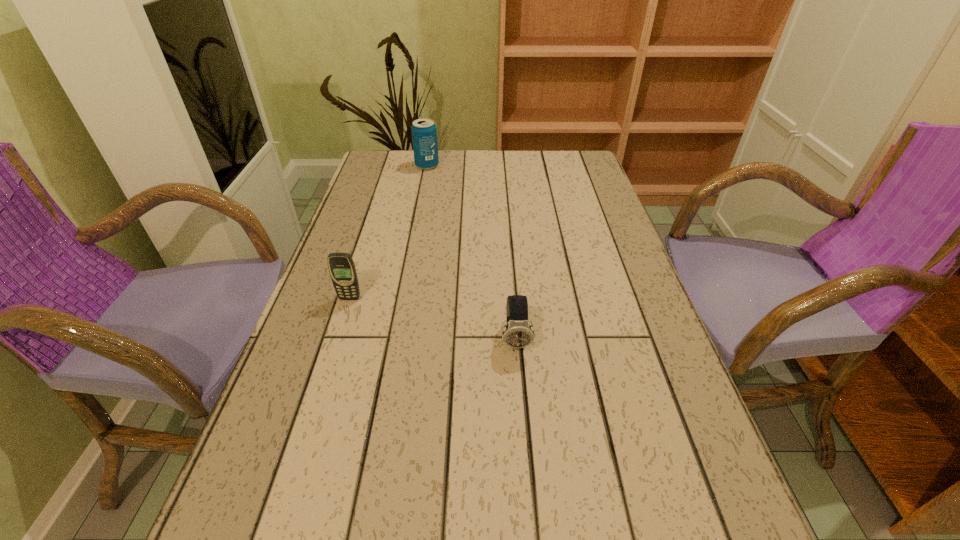
I want to click on the tallest object, so click(424, 132).

You are a GUI agent. You are given a task and a screenshot of the screen. Output one action in this format:
    pyautogui.click(x=<x>, y=<y>)
    Task: Click on the farthest object
    The image size is (960, 540).
    Given the screenshot: What is the action you would take?
    pyautogui.click(x=424, y=132)

Identify the location of cellular telephone. (341, 266).

Where is `the leftmost object`? The width and height of the screenshot is (960, 540). the leftmost object is located at coordinates (341, 266).

Find the location of a particular element. The height and width of the screenshot is (540, 960). the nearest object is located at coordinates (517, 334).

Identify the location of watch. 517,334.

The height and width of the screenshot is (540, 960). What are the coordinates of `free spot located on the right of the farthest object` in the screenshot? It's located at (551, 166).

I want to click on vacant space located on the screen of the cellular telephone, so [x=333, y=350].

Locate an element on the screen. The width and height of the screenshot is (960, 540). free space located 0.320m on the face of the watch is located at coordinates [532, 539].

Locate an element on the screen. object located in the far edge section of the desktop is located at coordinates (424, 132).